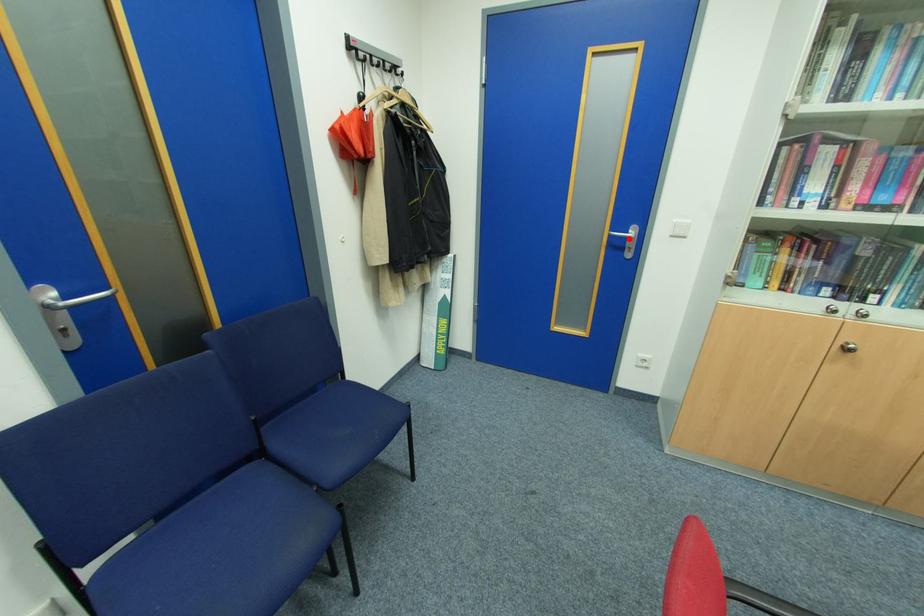
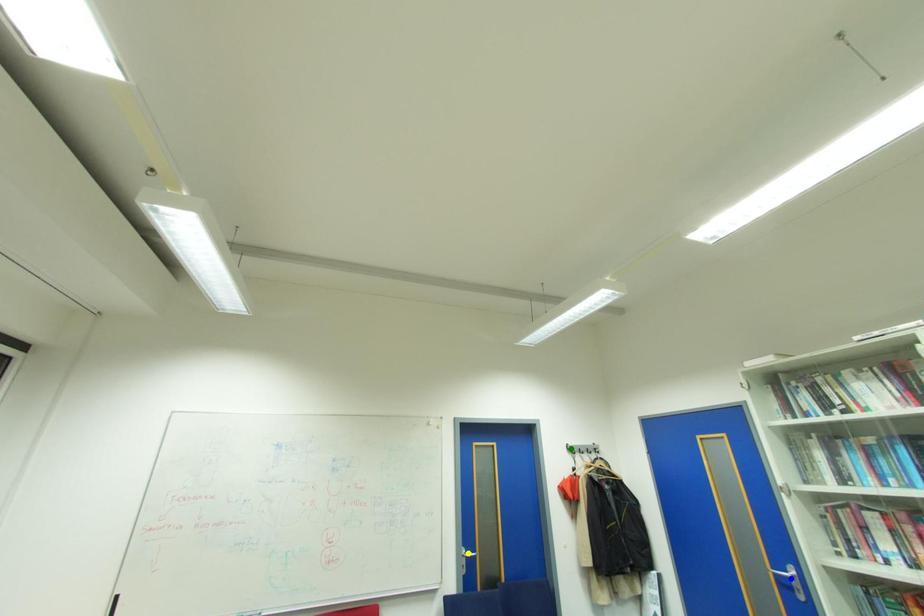
Question: I am providing you with two images of the same scene from different viewpoints. A red point is marked on the first image. You are given multiple points on the second image. Can you choose the point in image 2 that corresponds to the point in image 1?

Choices:
 (A) green point
 (B) yellow point
 (C) blue point

Answer: (C)